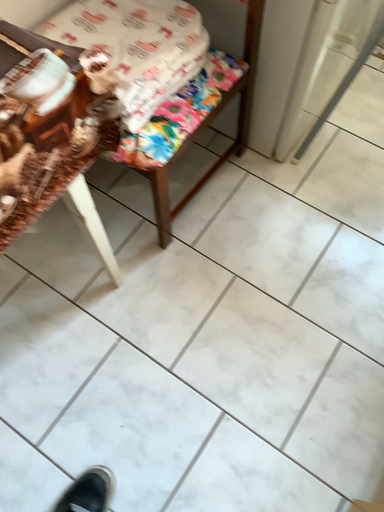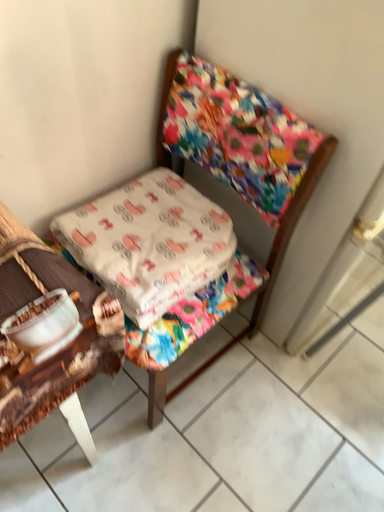
Question: Which way did the camera rotate in the video?

Choices:
 (A) rotated downward
 (B) rotated upward

Answer: (B)